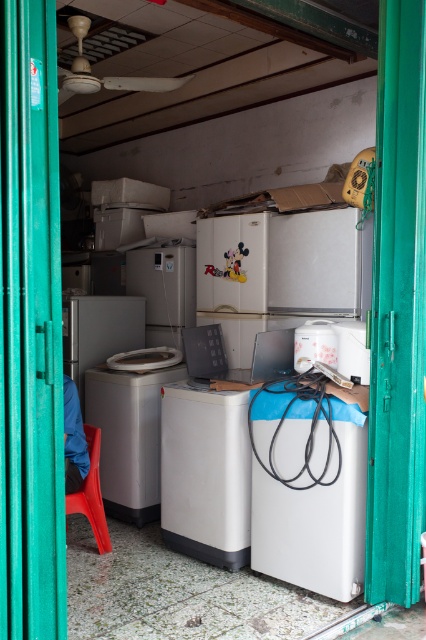
Question: Observing the image, what is the correct spatial positioning of green fabric curtain at left in reference to white glossy washing machine at center?

Choices:
 (A) right
 (B) left

Answer: (B)

Question: Which of the following is the farthest from the observer?

Choices:
 (A) (37, 132)
 (B) (143, 420)
 (C) (207, 420)

Answer: (B)

Question: Which object is closer to the camera taking this photo?

Choices:
 (A) green fabric curtain at left
 (B) red plastic chair at lower left
 (C) satin white washing machine at center

Answer: (A)

Question: Is green fabric curtain at right behind satin silver washing machine at left?

Choices:
 (A) no
 (B) yes

Answer: (A)

Question: Is green fabric curtain at left closer to camera compared to white plastic toaster at center?

Choices:
 (A) yes
 (B) no

Answer: (A)

Question: Based on their relative distances, which object is farther from the red plastic chair at lower left?

Choices:
 (A) green fabric curtain at right
 (B) green fabric curtain at left
 (C) white plastic toaster at center

Answer: (A)